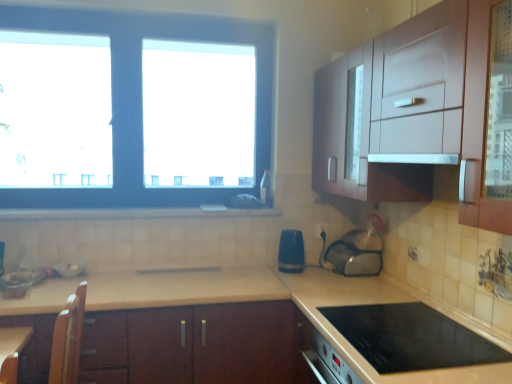
Identify the location of free space above brown wood cabinet at center (from a real-world perspective). (156, 280).